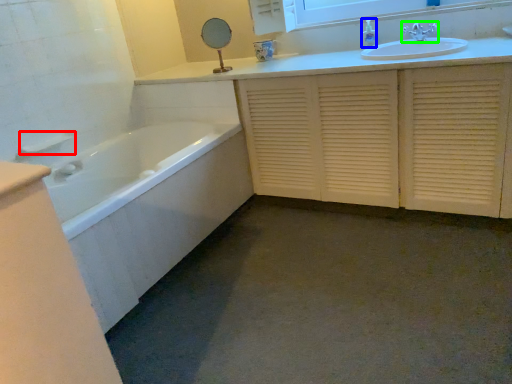
Question: Considering the real-world distances, which object is closest to towel bar (highlighted by a red box)? toiletry (highlighted by a blue box) or tap (highlighted by a green box).

Choices:
 (A) toiletry
 (B) tap

Answer: (A)